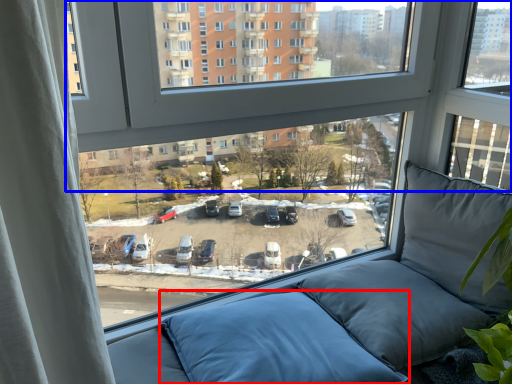
Question: Which of the following is the farthest to the observer, pillow (highlighted by a red box) or window (highlighted by a blue box)?

Choices:
 (A) pillow
 (B) window

Answer: (A)